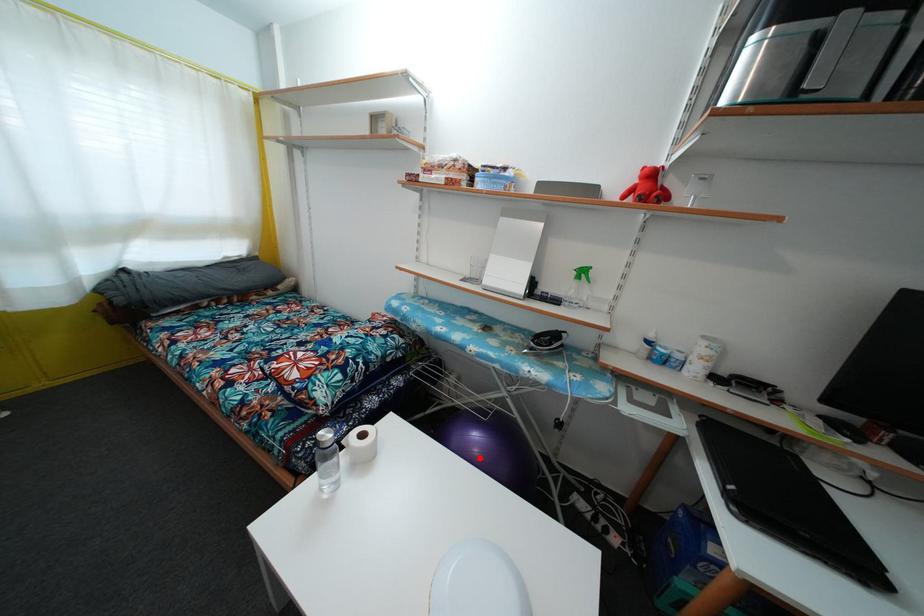
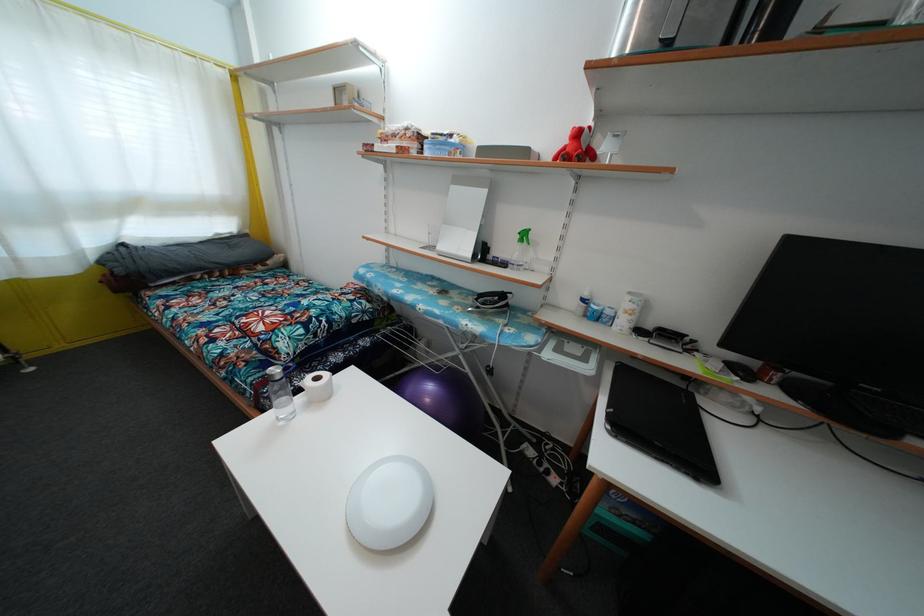
Find the pixel in the second image that matches the highlighted location in the first image.

(431, 407)